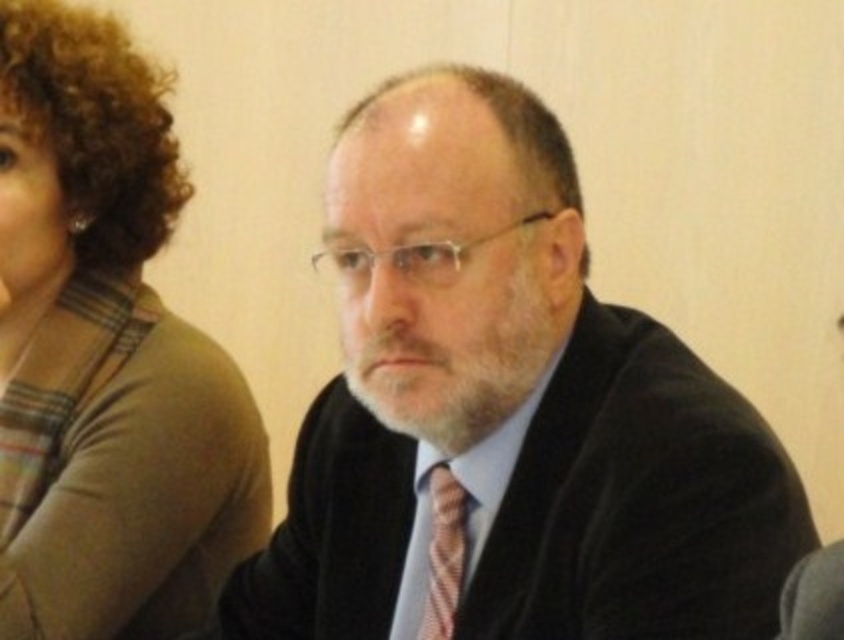
You are a photographer setting up for a portrait session. You need to ensure that the black velvet suit at center and the pink textured tie at center are clearly visible in the frame. Given that your camera has a minimum focus distance of 7 inches, will you be able to focus on both items without moving the camera closer?

The black velvet suit at center is 6.96 inches from the pink textured tie at center. Since the camera requires at least 7 inches to focus, the distance between them is slightly less than the minimum focus requirement. Therefore, the camera may not be able to focus on both items clearly without adjusting the camera position or zoom.

You are a photographer setting up for a group photo. You need to ensure that all clothing details are visible. Given the brown plaid shirt at upper left and the pink textured tie at center, which one might require more lighting adjustment to be properly captured?

The brown plaid shirt at upper left has a larger size compared to the pink textured tie at center, so the larger brown plaid shirt at upper left may require more lighting adjustment to ensure its details are properly captured.

You are a photographer setting up a portrait session. You notice the brown plaid shirt at upper left and the pink textured tie at center in the frame. Which object should you adjust to ensure both are visible within the camera frame? Explain your reasoning.

The brown plaid shirt at upper left has a greater height compared to the pink textured tie at center. To ensure both are visible, you should adjust the camera angle or zoom to accommodate the taller brown plaid shirt at upper left, as it occupies more vertical space in the frame.